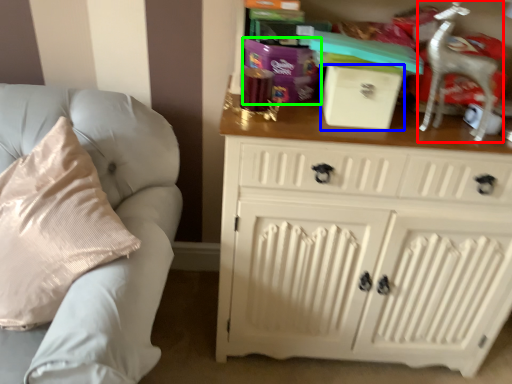
Question: Based on their relative distances, which object is nearer to rocking chair (highlighted by a red box)? Choose from box (highlighted by a blue box) and gift (highlighted by a green box).

Choices:
 (A) box
 (B) gift

Answer: (A)